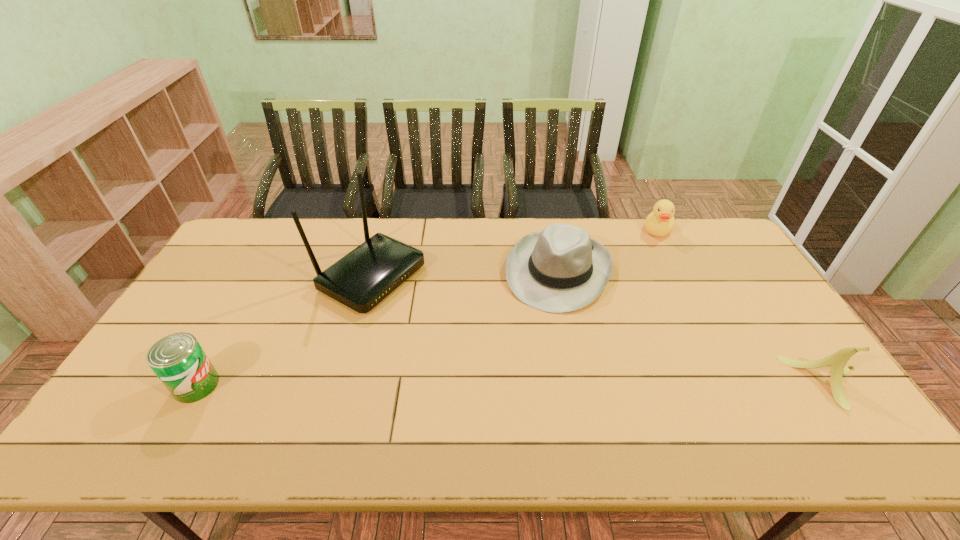
The height and width of the screenshot is (540, 960). I want to click on vacant space on the desktop that is between the can and the rightmost object and is positioned on the front-facing side of the third object from right to left, so pos(514,383).

Identify the location of free spot on the desktop that is between the can and the banana and is positioned at the beak of the duck. (599, 383).

Identify the location of free space on the desktop that is between the can and the rightmost object and is positioned on the front-facing side of the tallest object. The height and width of the screenshot is (540, 960). (584, 383).